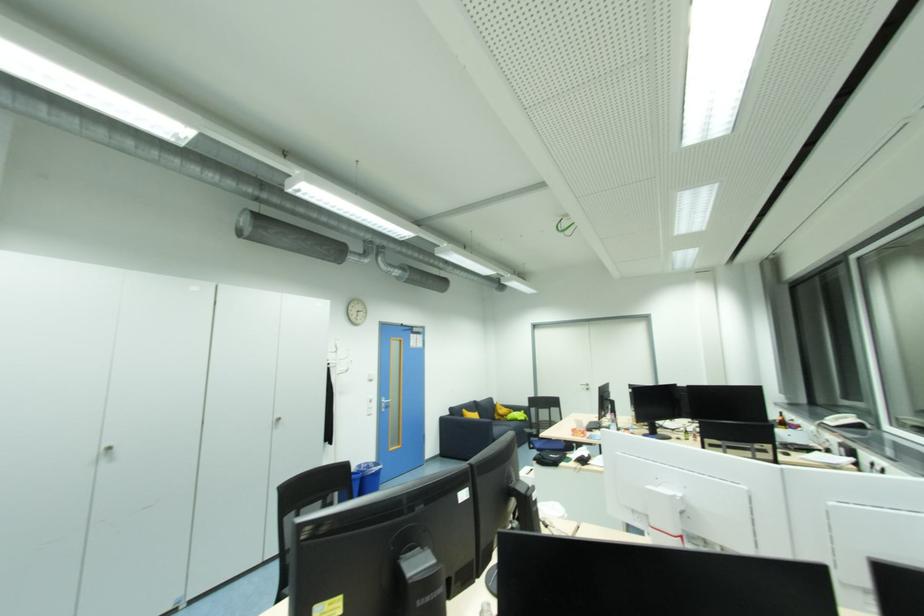
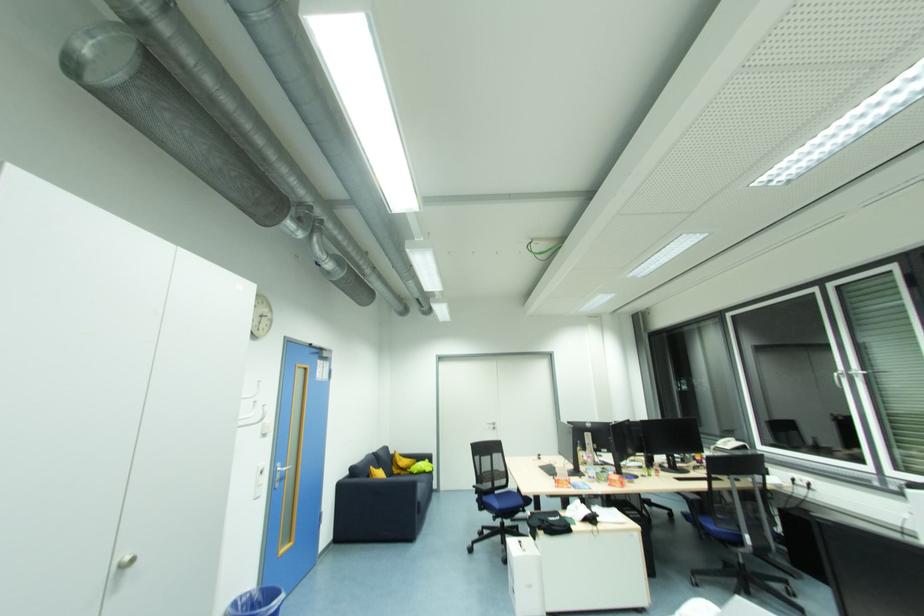
Locate, in the second image, the point that corresponds to pixel 865 424 in the first image.

(745, 446)